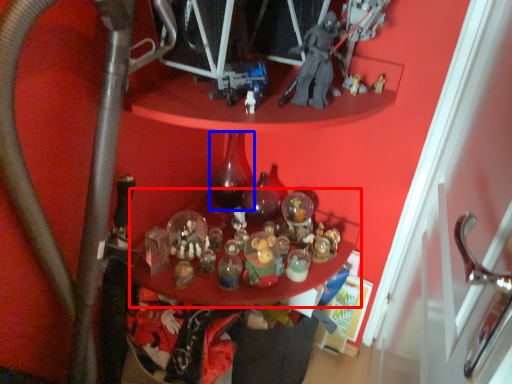
Question: Which object is further to the camera taking this photo, table (highlighted by a red box) or bottle (highlighted by a blue box)?

Choices:
 (A) table
 (B) bottle

Answer: (B)